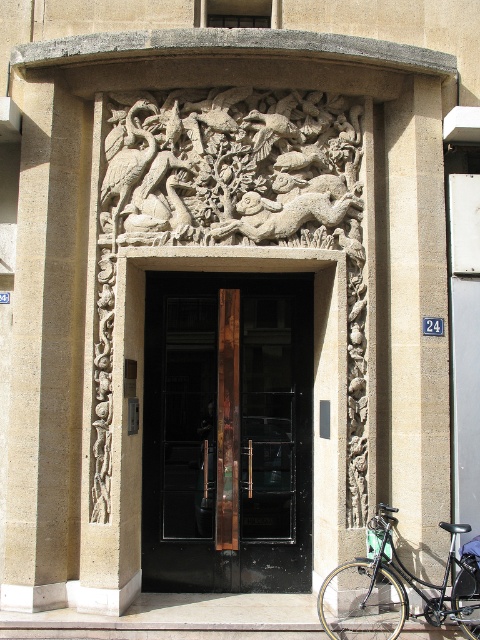
You are standing in front of the entrance and want to enter through the door. There is a black glass door at center and a black matte bicycle at lower right. Which object should you approach to enter?

The black glass door at center is positioned on the left side of the black matte bicycle at lower right, so you should approach the black glass door at center to enter.

You are standing in front of the entrance and want to locate the point at coordinates point (46, 352). Based on the scene description, where would this point be located?

The point (46, 352) is on the smooth stone pillar at left.

You are a painter standing at the entrance and want to paint both the white stone relief at center and the black matte bicycle at lower right. Which object should you focus on first if you want to paint the taller one first?

The white stone relief at center is much taller than the black matte bicycle at lower right, so you should focus on painting the white stone relief at center first.